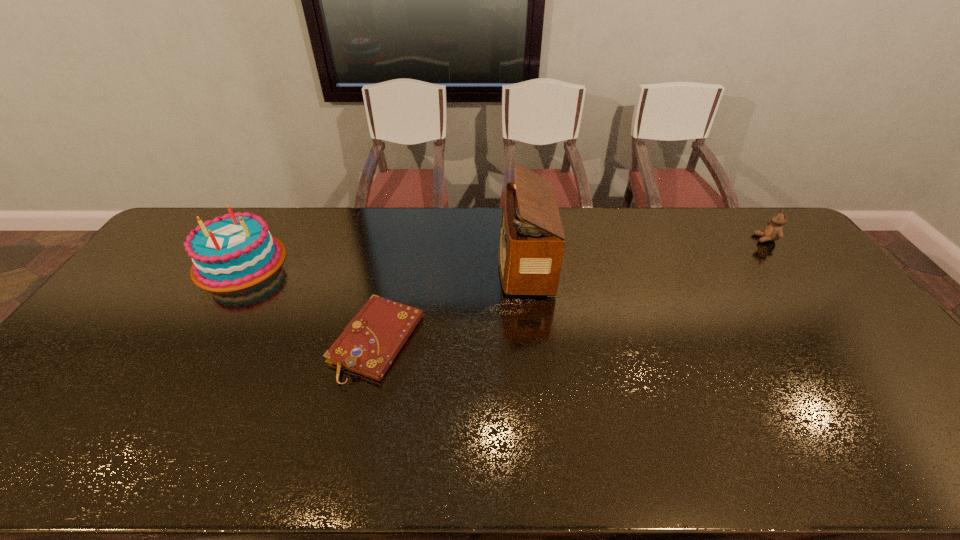
Where is `free location located on the front panel of the radio receiver`? free location located on the front panel of the radio receiver is located at coordinates 450,262.

Locate an element on the screen. This screenshot has width=960, height=540. free space located on the right of the second tallest object is located at coordinates (326, 261).

Where is `vacant space located on the front-facing side of the rightmost object`? vacant space located on the front-facing side of the rightmost object is located at coordinates (732, 239).

Locate an element on the screen. blank space located on the front-facing side of the rightmost object is located at coordinates (675, 239).

Where is `vacant point located 0.260m on the front-facing side of the rightmost object`? vacant point located 0.260m on the front-facing side of the rightmost object is located at coordinates (681, 239).

What are the coordinates of `vacant space located 0.400m on the right of the third object from right to left` in the screenshot? It's located at (566, 341).

Where is `radio receiver located at the far edge`? This screenshot has width=960, height=540. radio receiver located at the far edge is located at coordinates (531, 246).

Image resolution: width=960 pixels, height=540 pixels. Find the location of `birthday cake present at the far edge`. birthday cake present at the far edge is located at coordinates [236, 251].

The height and width of the screenshot is (540, 960). In order to click on teddy bear positioned at the far edge in this screenshot , I will do `click(774, 231)`.

At what (x,y) coordinates should I click in order to perform the action: click on object at the left edge. Please return your answer as a coordinate pair (x, y). Looking at the image, I should click on (236, 251).